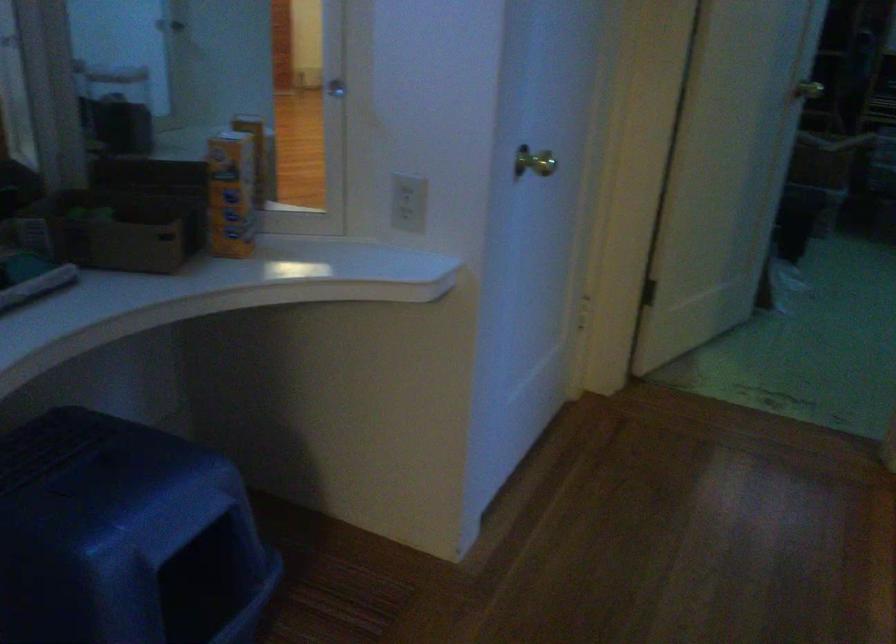
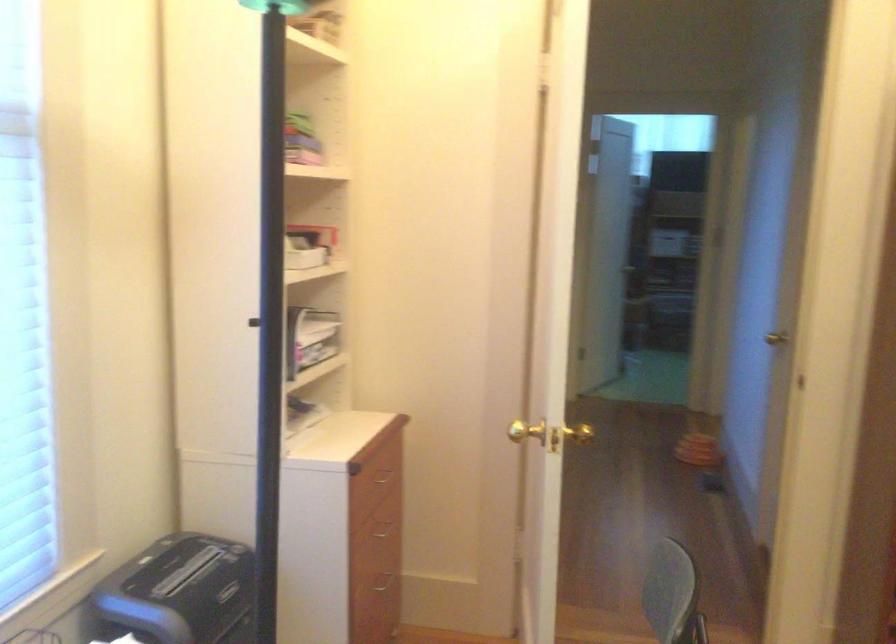
Question: I am providing you with two images of the same scene from different viewpoints. After the viewpoint changes to image2, which objects are now occluded?

Choices:
 (A) brown cardboard box
 (B) black round container
 (C) drawer handle
 (D) black paper shredder

Answer: (A)